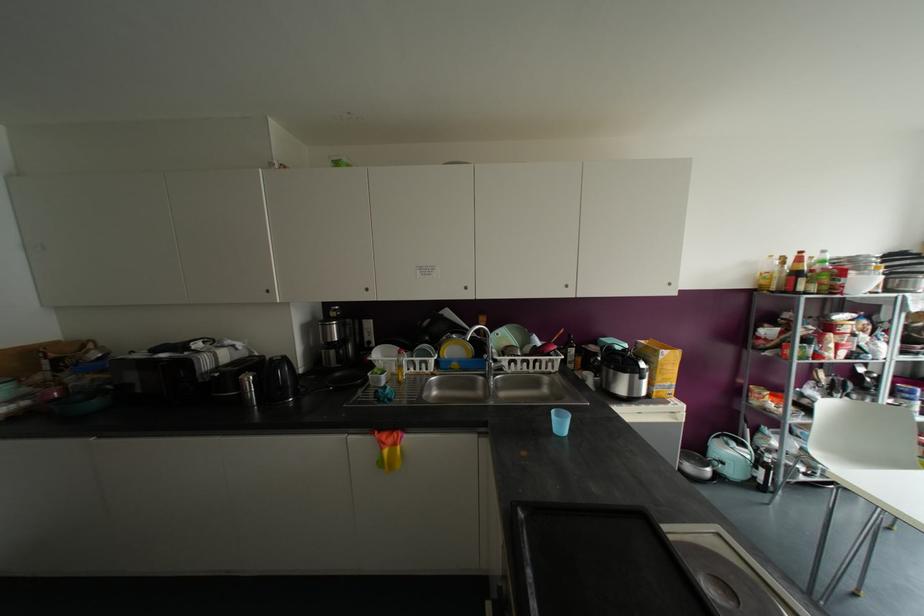
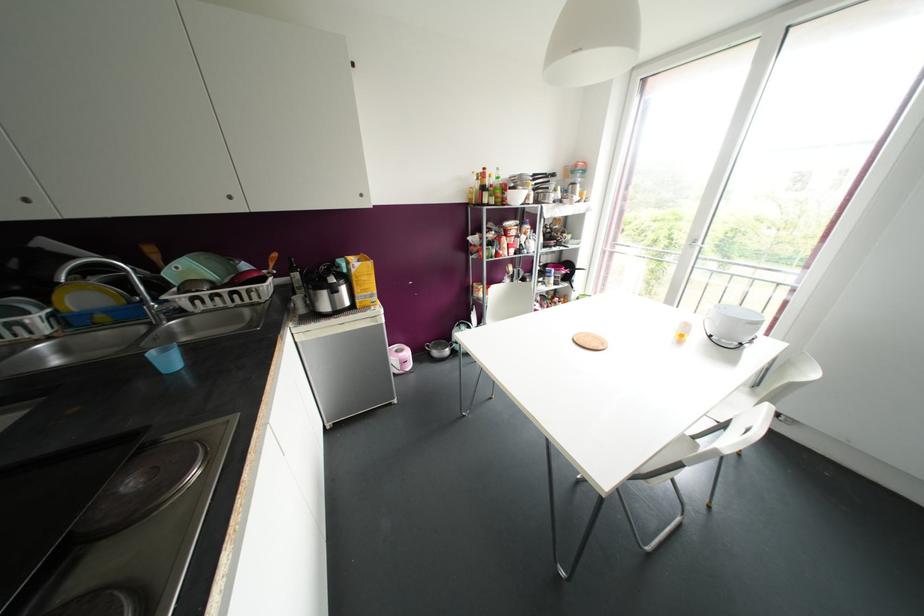
The point at (x=561, y=424) is marked in the first image. Where is the corresponding point in the second image?

(168, 361)